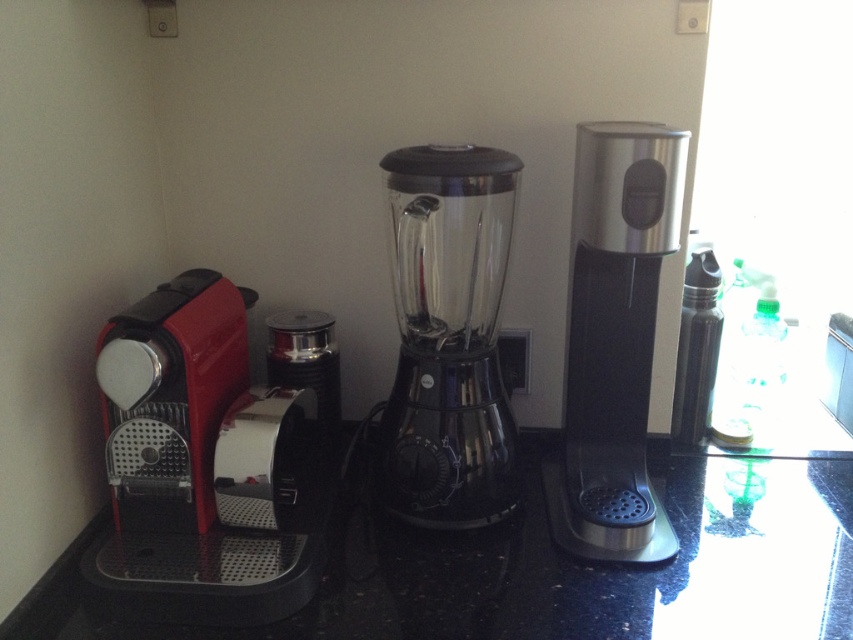
Who is higher up, shiny red coffee machine at left or polished stainless steel coffee machine at right?

Positioned higher is polished stainless steel coffee machine at right.

Measure the distance from shiny red coffee machine at left to polished stainless steel coffee machine at right.

They are 17.32 inches apart.

The width and height of the screenshot is (853, 640). Describe the element at coordinates (206, 467) in the screenshot. I see `shiny red coffee machine at left` at that location.

Locate an element on the screen. shiny red coffee machine at left is located at coordinates (206, 467).

Can you confirm if black glossy countertop at lower left is wider than shiny red coffee machine at left?

Correct, the width of black glossy countertop at lower left exceeds that of shiny red coffee machine at left.

Based on the photo, does black glossy countertop at lower left have a lesser height compared to shiny red coffee machine at left?

Yes, black glossy countertop at lower left is shorter than shiny red coffee machine at left.

Between point (462, 621) and point (213, 605), which one is positioned behind?

The point (462, 621) is more distant.

I want to click on black glossy countertop at lower left, so click(x=560, y=568).

Is black glossy countertop at lower left in front of transparent glass blender at center?

Yes, black glossy countertop at lower left is in front of transparent glass blender at center.

Which is more to the right, black glossy countertop at lower left or transparent glass blender at center?

From the viewer's perspective, black glossy countertop at lower left appears more on the right side.

Where is `black glossy countertop at lower left`? black glossy countertop at lower left is located at coordinates (560, 568).

You are a GUI agent. You are given a task and a screenshot of the screen. Output one action in this format:
    pyautogui.click(x=<x>, y=<y>)
    Task: Click on the black glossy countertop at lower left
    This screenshot has width=853, height=640.
    Given the screenshot: What is the action you would take?
    pyautogui.click(x=560, y=568)